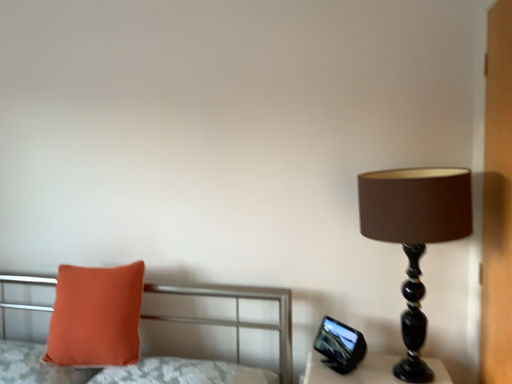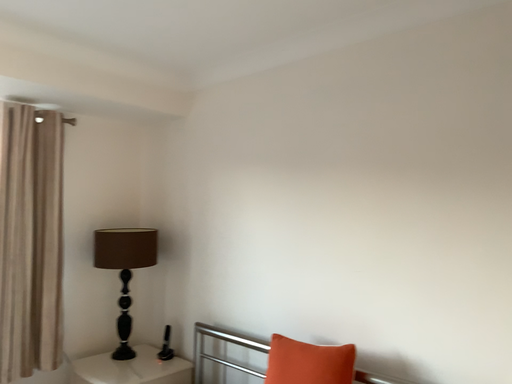
Question: Which way did the camera rotate in the video?

Choices:
 (A) rotated left
 (B) rotated right

Answer: (A)